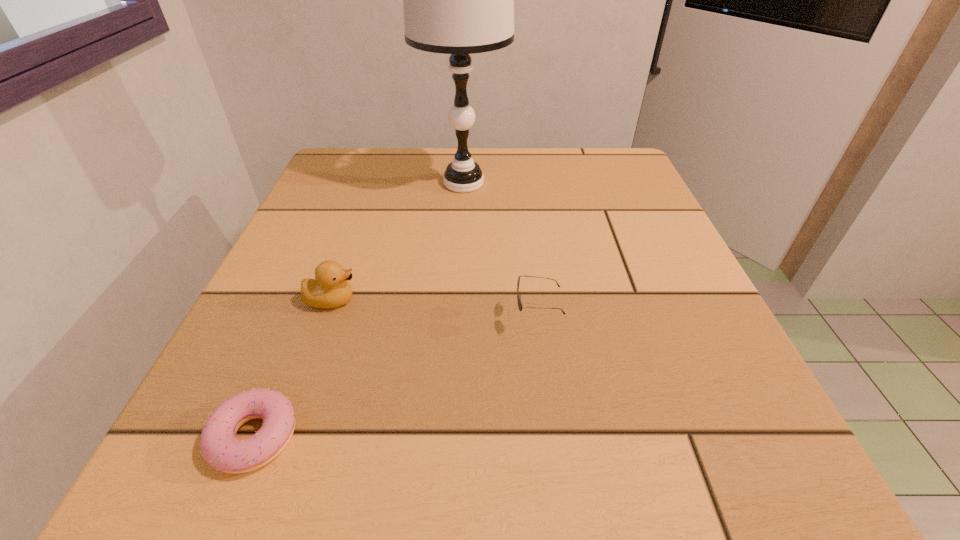
You are a GUI agent. You are given a task and a screenshot of the screen. Output one action in this format:
    pyautogui.click(x=<x>, y=<y>)
    Task: Click on the vacant region located 0.090m in front of the lenses of the sunglasses
    This screenshot has height=540, width=960.
    Given the screenshot: What is the action you would take?
    pyautogui.click(x=454, y=319)

Where is `free location located 0.090m on the back of the shortest object`? The image size is (960, 540). free location located 0.090m on the back of the shortest object is located at coordinates (292, 345).

You are a GUI agent. You are given a task and a screenshot of the screen. Output one action in this format:
    pyautogui.click(x=<x>, y=<y>)
    Task: Click on the object that is at the far edge
    This screenshot has width=960, height=540.
    Given the screenshot: What is the action you would take?
    click(459, 0)

You are a GUI agent. You are given a task and a screenshot of the screen. Output one action in this format:
    pyautogui.click(x=<x>, y=<y>)
    Task: Click on the object that is at the near edge
    The height and width of the screenshot is (540, 960).
    Given the screenshot: What is the action you would take?
    pyautogui.click(x=221, y=449)

Where is `duckling that is at the left edge`? This screenshot has height=540, width=960. duckling that is at the left edge is located at coordinates (330, 289).

Where is `doughnut at the left edge`? The image size is (960, 540). doughnut at the left edge is located at coordinates (221, 449).

Find the location of a particular element. object that is at the near left corner is located at coordinates (221, 449).

Image resolution: width=960 pixels, height=540 pixels. I want to click on vacant space at the far edge, so click(418, 155).

Identify the location of free spot at the near edge of the desktop. (429, 463).

Where is `vacant space at the left edge of the desktop`? The width and height of the screenshot is (960, 540). vacant space at the left edge of the desktop is located at coordinates (301, 215).